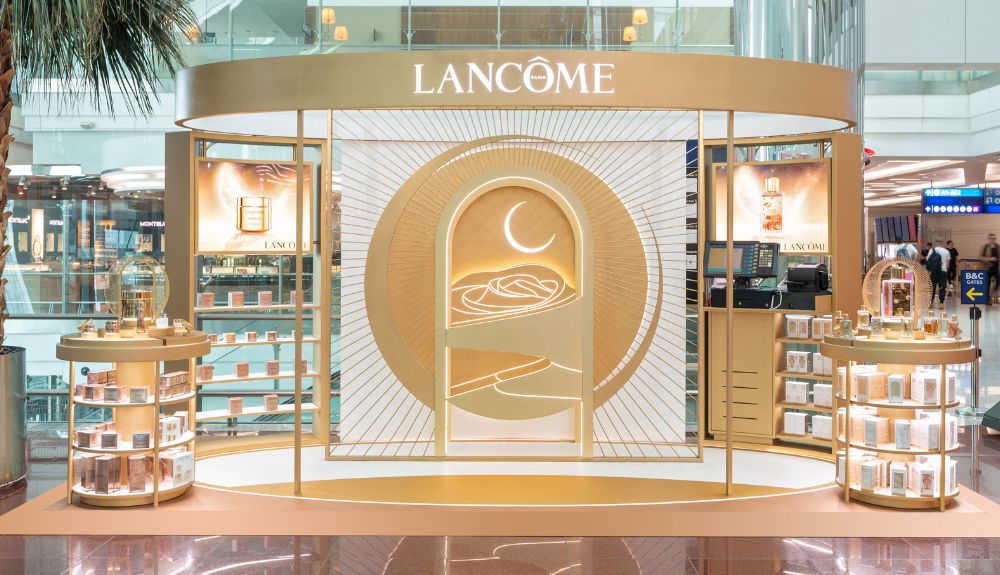
This screenshot has width=1000, height=575. Identify the location of white backdrop. (404, 161).